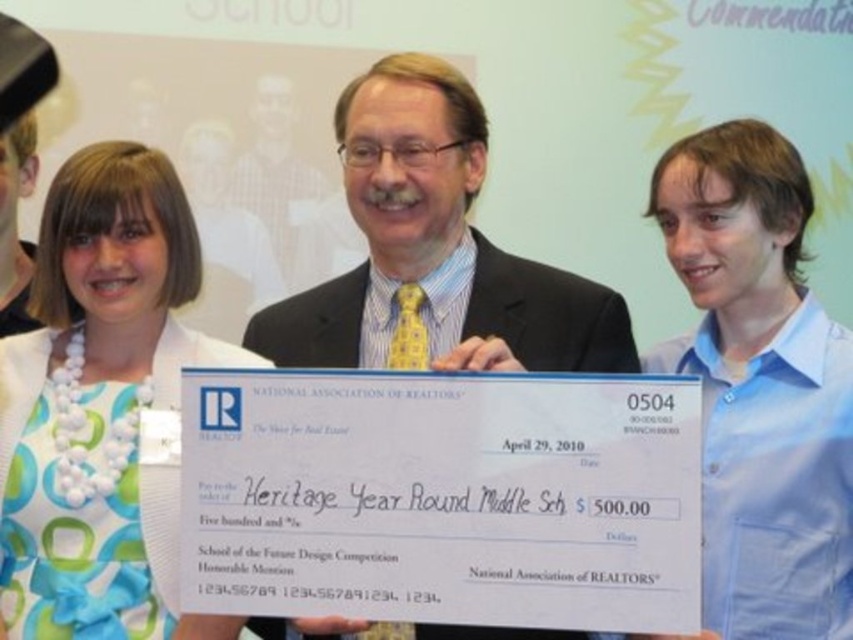
Is point (850, 624) positioned in front of point (262, 157)?

Yes, it is in front of point (262, 157).

Between point (703, 540) and point (289, 134), which one is positioned in front?

Point (703, 540) is in front.

At what (x,y) coordinates should I click in order to perform the action: click on white pearl necklace at upper left. Please return your answer as a coordinate pair (x, y). Looking at the image, I should click on (759, 385).

Between point (157, 221) and point (235, 189), which one is positioned in front?

Positioned in front is point (157, 221).

Does white fabric dress at upper left have a larger size compared to matte yellow tie at center?

Yes, white fabric dress at upper left is bigger than matte yellow tie at center.

Is point (85, 515) farther from viewer compared to point (277, 291)?

No.

At what (x,y) coordinates should I click in order to perform the action: click on white fabric dress at upper left. Please return your answer as a coordinate pair (x, y). The height and width of the screenshot is (640, 853). Looking at the image, I should click on (97, 397).

From the picture: Can you confirm if matte black suit at center is wider than matte yellow tie at center?

Yes, matte black suit at center is wider than matte yellow tie at center.

Which is in front, point (517, 321) or point (279, 198)?

Positioned in front is point (517, 321).

Identify the location of matte black suit at center. (434, 252).

At what (x,y) coordinates should I click in order to perform the action: click on matte black suit at center. Please return your answer as a coordinate pair (x, y). The height and width of the screenshot is (640, 853). Looking at the image, I should click on (434, 252).